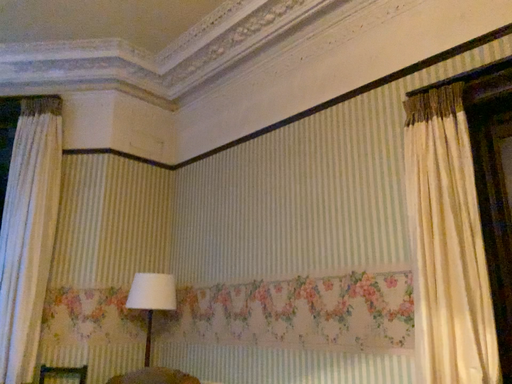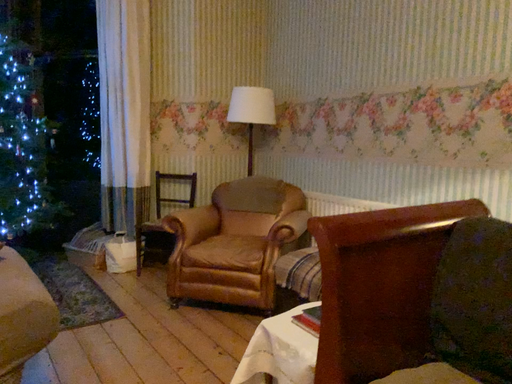
Question: How did the camera likely rotate when shooting the video?

Choices:
 (A) rotated right
 (B) rotated left

Answer: (B)